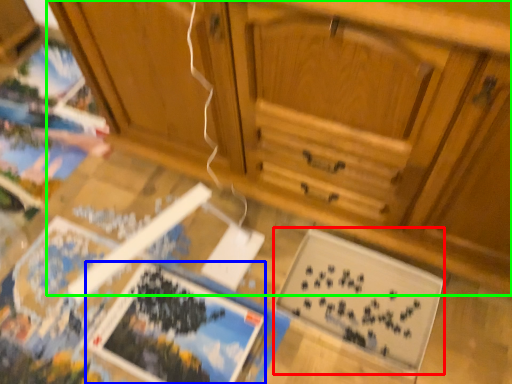
Question: Based on their relative distances, which object is farther from magazine (highlighted by a red box)? Choose from magazine (highlighted by a blue box) and cabinetry (highlighted by a green box).

Choices:
 (A) magazine
 (B) cabinetry

Answer: (B)